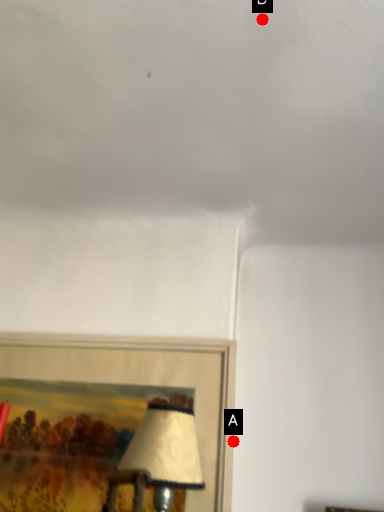
Question: Two points are circled on the image, labeled by A and B beside each circle. Which point is closer to the camera?

Choices:
 (A) A is closer
 (B) B is closer

Answer: (B)